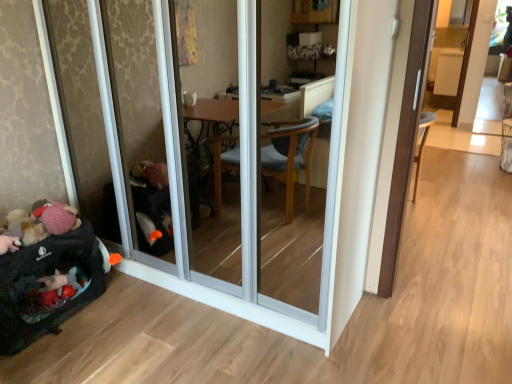
This screenshot has height=384, width=512. I want to click on free space that is in between transparent glass screen door at left and dark gray fabric baby carriage at lower left, so click(148, 336).